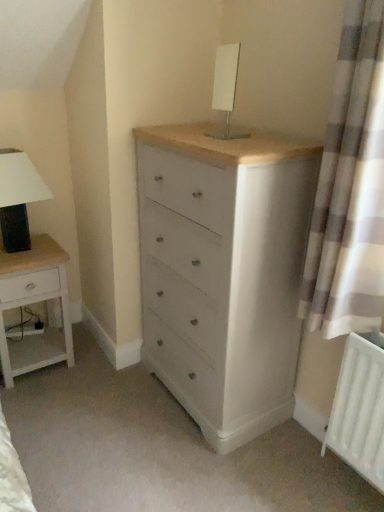
Find the location of `free point in front of matte white chest of drawers at center`. free point in front of matte white chest of drawers at center is located at coordinates (208, 467).